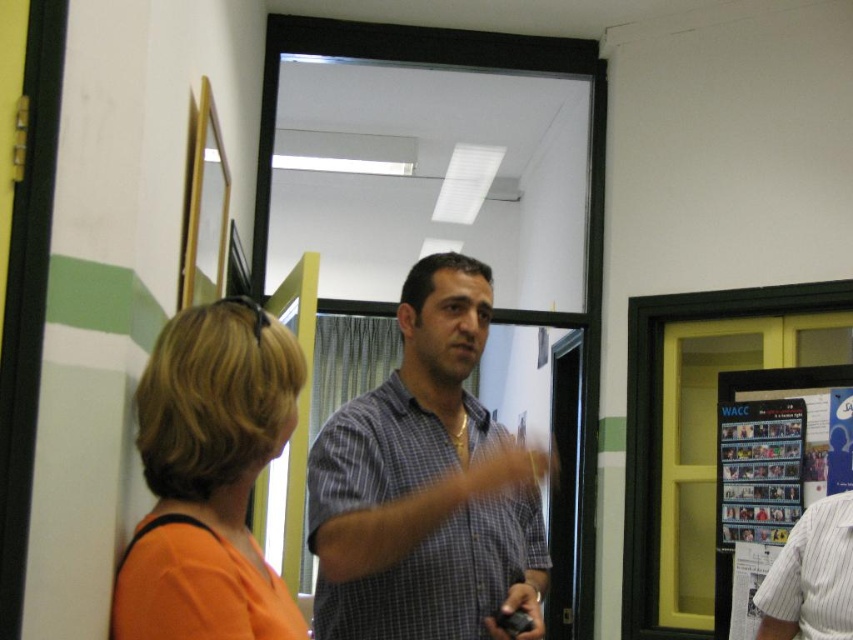
Is point (846, 625) farther from camera compared to point (515, 612)?

Yes.

At what (x,y) coordinates should I click in order to perform the action: click on white striped shirt at right. Please return your answer as a coordinate pair (x, y). The height and width of the screenshot is (640, 853). Looking at the image, I should click on pos(811,577).

Where is `white striped shirt at right`? This screenshot has width=853, height=640. white striped shirt at right is located at coordinates (811, 577).

Is checkered fabric shirt at center above black plastic remote at center?

Correct, checkered fabric shirt at center is located above black plastic remote at center.

Between point (426, 384) and point (494, 620), which one is positioned in front?

Point (494, 620) is in front.

Is point (419, 410) farther from viewer compared to point (531, 628)?

Yes, it is.

This screenshot has width=853, height=640. What are the coordinates of `checkered fabric shirt at center` in the screenshot? It's located at (426, 484).

Does orange fabric shirt at left have a greater height compared to black plastic remote at center?

Indeed, orange fabric shirt at left has a greater height compared to black plastic remote at center.

Is point (238, 365) closer to camera compared to point (503, 627)?

Yes, point (238, 365) is in front of point (503, 627).

Describe the element at coordinates (209, 477) in the screenshot. I see `orange fabric shirt at left` at that location.

Locate an element on the screen. Image resolution: width=853 pixels, height=640 pixels. orange fabric shirt at left is located at coordinates (209, 477).